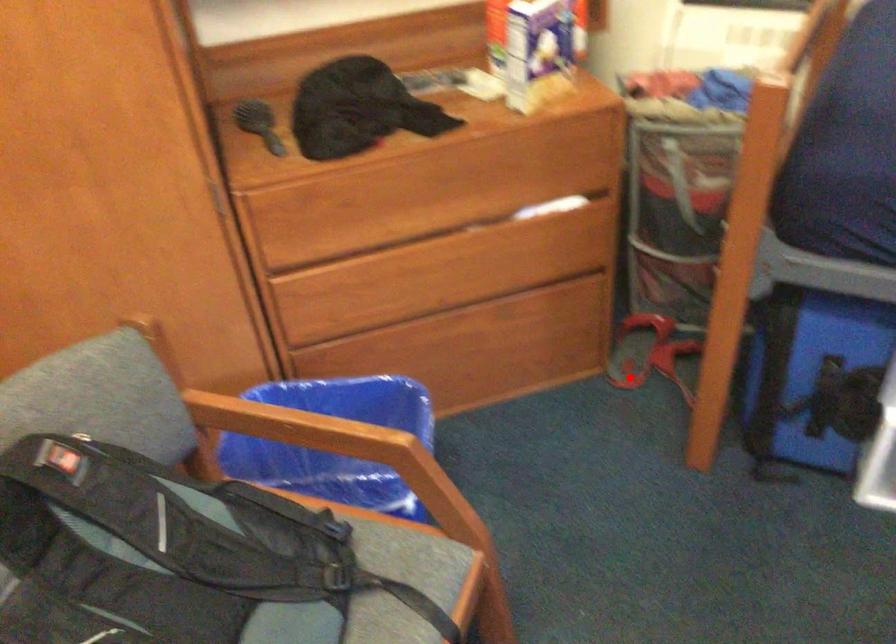
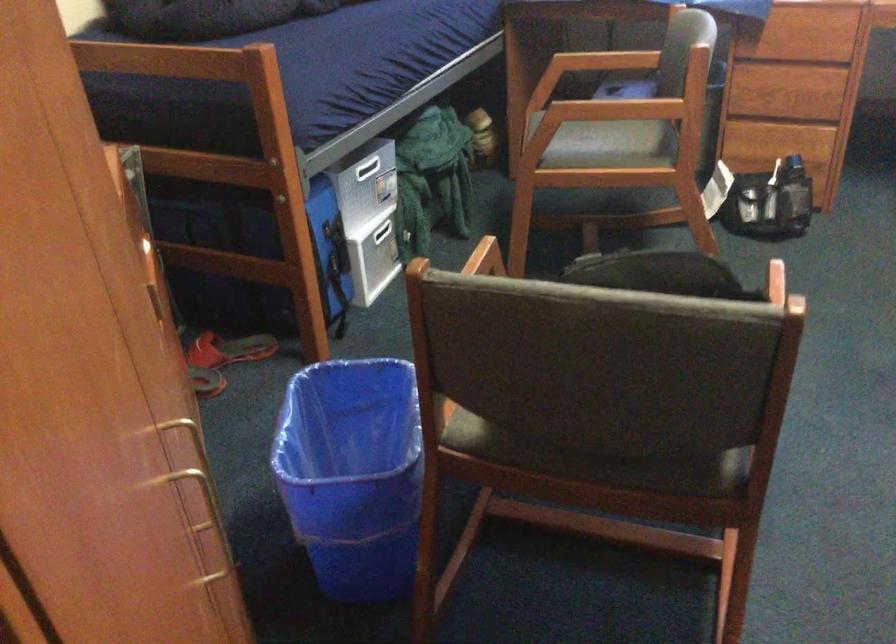
Locate, in the second image, the point that corresponds to the highlighted location in the first image.

(205, 381)